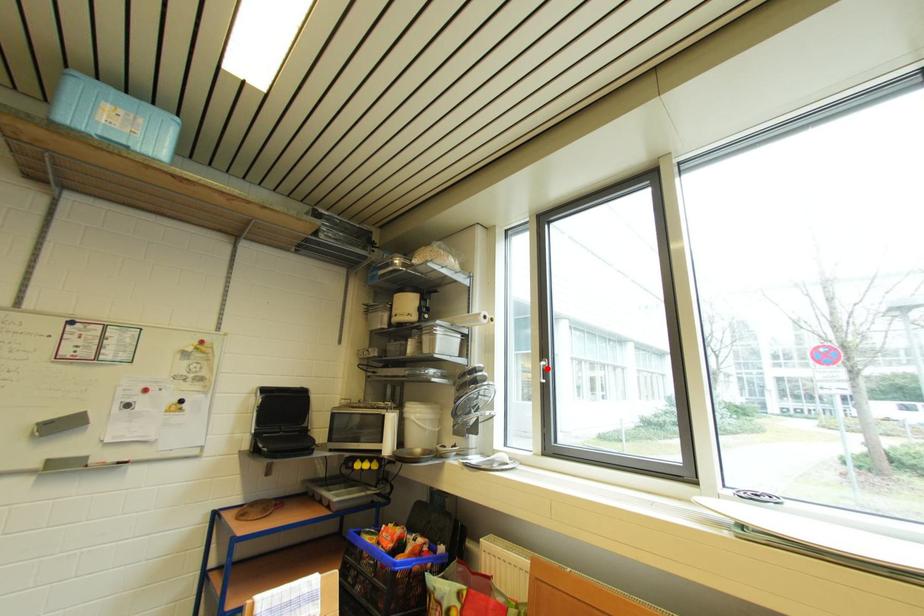
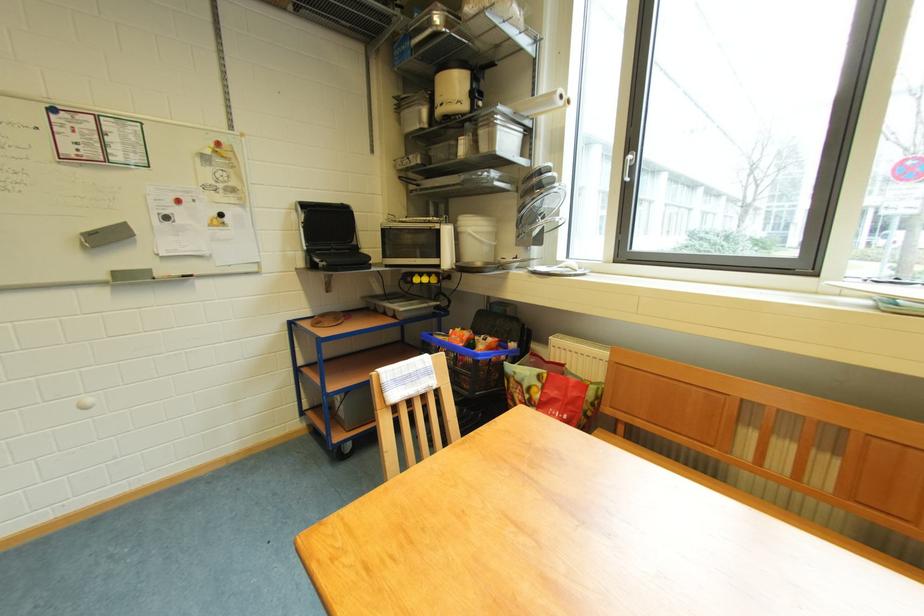
Question: I am providing you with two images of the same scene from different viewpoints. Given a red point in image1, look at the same physical point in image2. Is it:

Choices:
 (A) Closer to the viewpoint
 (B) Farther from the viewpoint

Answer: (A)